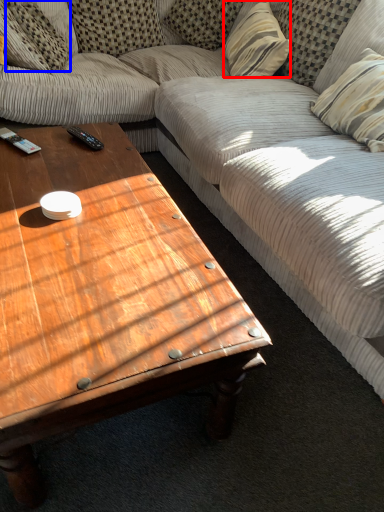
Question: Which object is closer to the camera taking this photo, pillow (highlighted by a red box) or pillow (highlighted by a blue box)?

Choices:
 (A) pillow
 (B) pillow

Answer: (A)